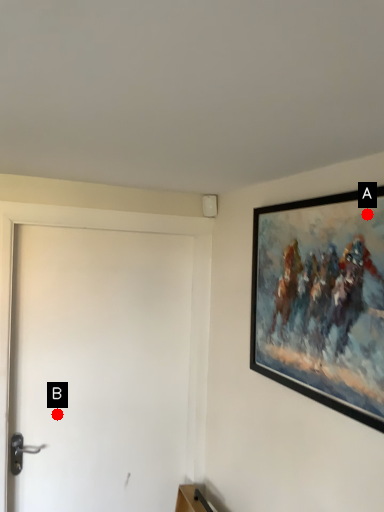
Question: Two points are circled on the image, labeled by A and B beside each circle. Which of the following is the farthest from the observer?

Choices:
 (A) A is further
 (B) B is further

Answer: (B)